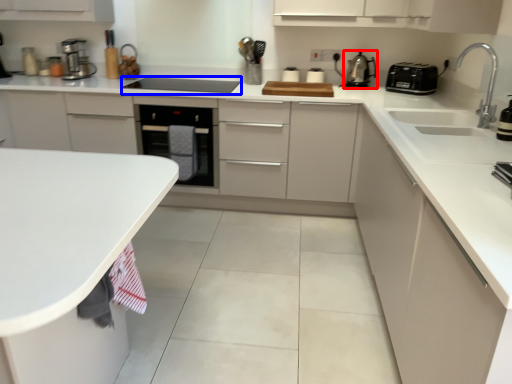
Question: Which point is closer to the camera, kitchen appliance (highlighted by a red box) or appliance (highlighted by a blue box)?

Choices:
 (A) kitchen appliance
 (B) appliance

Answer: (B)